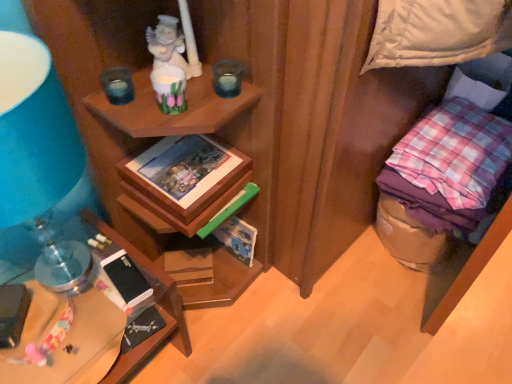
Locate an element on the screen. transparent glass candle at upper center, the first candle holder in the right-to-left sequence is located at coordinates (227, 78).

This screenshot has width=512, height=384. Identify the location of wooden picture frame at center. (185, 173).

Find the location of `wooden desk at lower left`. wooden desk at lower left is located at coordinates (96, 325).

What do you see at coordinates (169, 89) in the screenshot? The image size is (512, 384). I see `white glossy cup at upper center, the 2th candle holder in the right-to-left sequence` at bounding box center [169, 89].

Measure the distance between black matte mobile phone at lower left, the 2th mobile phone viewed from the left, and camera.

black matte mobile phone at lower left, the 2th mobile phone viewed from the left, is 1.00 meters from camera.

In order to face brown cardboard magazine at lower center, should I rotate leftwards or rightwards?

To align with it, rotate left about 8.852°.

This screenshot has width=512, height=384. What are the coordinates of `brown cardboard magazine at lower center` in the screenshot? It's located at (189, 266).

Measure the distance between point (460,108) and camera.

1.28 meters.

Where is `transparent glass candle at upper center, the first candle holder in the right-to-left sequence`? Image resolution: width=512 pixels, height=384 pixels. transparent glass candle at upper center, the first candle holder in the right-to-left sequence is located at coordinates (227, 78).

Is wooden desk at lower left looking in the opposite direction of wooden picture frame at center?

No, wooden desk at lower left's orientation is not away from wooden picture frame at center.

Is wooden desk at lower left wider than wooden picture frame at center?

Yes.

Which object is positioned more to the left, wooden desk at lower left or wooden picture frame at center?

wooden desk at lower left.

At what (x,y) coordinates should I click in order to perform the action: click on desk in front of the wooden picture frame at center. Please return your answer as a coordinate pair (x, y). The height and width of the screenshot is (384, 512). Looking at the image, I should click on (96, 325).

From a real-world perspective, is brown cardboard magazine at lower center physically above white glossy cup at upper center, the 2th candle holder positioned from the left?

No, from a real-world perspective, brown cardboard magazine at lower center is not on top of white glossy cup at upper center, the 2th candle holder positioned from the left.

Which is closer to the camera, [170,258] or [178,68]?

Point [170,258].

How different are the orientations of brown cardboard magazine at lower center and white glossy cup at upper center, the 2th candle holder in the right-to-left sequence, in degrees?

brown cardboard magazine at lower center and white glossy cup at upper center, the 2th candle holder in the right-to-left sequence, are facing 8.82 degrees away from each other.

Is brown cardboard magazine at lower center turned away from white glossy cup at upper center, the 2th candle holder in the right-to-left sequence?

No, brown cardboard magazine at lower center is not facing away from white glossy cup at upper center, the 2th candle holder in the right-to-left sequence.

How many degrees apart are the facing directions of wooden picture frame at center and wooden desk at lower left?

0.0576 degrees separate the facing orientations of wooden picture frame at center and wooden desk at lower left.

Is wooden picture frame at center looking in the opposite direction of wooden desk at lower left?

No, wooden picture frame at center's orientation is not away from wooden desk at lower left.

Considering the relative positions of wooden picture frame at center and wooden desk at lower left in the image provided, is wooden picture frame at center to the right of wooden desk at lower left from the viewer's perspective?

Yes.

Is wooden picture frame at center next to wooden desk at lower left and touching it?

No, wooden picture frame at center is not in contact with wooden desk at lower left.

Considering the relative sizes of brown cardboard magazine at lower center and translucent glass candle at upper center, marked as the 3th candle holder in a right-to-left arrangement, in the image provided, is brown cardboard magazine at lower center wider than translucent glass candle at upper center, marked as the 3th candle holder in a right-to-left arrangement,?

Yes, brown cardboard magazine at lower center is wider than translucent glass candle at upper center, marked as the 3th candle holder in a right-to-left arrangement.

Does brown cardboard magazine at lower center appear on the right side of translucent glass candle at upper center, marked as the 3th candle holder in a right-to-left arrangement?

Yes, brown cardboard magazine at lower center is to the right of translucent glass candle at upper center, marked as the 3th candle holder in a right-to-left arrangement.

Would you say translucent glass candle at upper center, marked as the 3th candle holder in a right-to-left arrangement, is part of brown cardboard magazine at lower center's contents?

No.

Which object is wider, wooden picture frame at center or translucent glass candle at upper center, the first candle holder in the left-to-right sequence?

wooden picture frame at center is wider.

From a real-world perspective, which object stands above the other?

translucent glass candle at upper center, the first candle holder in the left-to-right sequence.

Is wooden picture frame at center facing towards translucent glass candle at upper center, the first candle holder in the left-to-right sequence?

No, wooden picture frame at center does not turn towards translucent glass candle at upper center, the first candle holder in the left-to-right sequence.

Do you think wooden picture frame at center is within translucent glass candle at upper center, the first candle holder in the left-to-right sequence, or outside of it?

The correct answer is: outside.

How many degrees apart are the facing directions of white glossy cup at upper center, the 2th candle holder positioned from the left, and translucent glass candle at upper center, the first candle holder in the left-to-right sequence?

2.35 degrees.

Considering the positions of objects white glossy cup at upper center, the 2th candle holder positioned from the left, and translucent glass candle at upper center, the first candle holder in the left-to-right sequence, in the image provided, who is more to the left, white glossy cup at upper center, the 2th candle holder positioned from the left, or translucent glass candle at upper center, the first candle holder in the left-to-right sequence,?

translucent glass candle at upper center, the first candle holder in the left-to-right sequence, is more to the left.

From a real-world perspective, does white glossy cup at upper center, the 2th candle holder positioned from the left, sit lower than translucent glass candle at upper center, the first candle holder in the left-to-right sequence?

Actually, white glossy cup at upper center, the 2th candle holder positioned from the left, is physically above translucent glass candle at upper center, the first candle holder in the left-to-right sequence, in the real world.

Is white glossy cup at upper center, the 2th candle holder positioned from the left, shorter than translucent glass candle at upper center, marked as the 3th candle holder in a right-to-left arrangement?

In fact, white glossy cup at upper center, the 2th candle holder positioned from the left, may be taller than translucent glass candle at upper center, marked as the 3th candle holder in a right-to-left arrangement.

Considering the sizes of objects black matte mobile phone at lower left, the 1th mobile phone viewed from the right, and translucent glass candle at upper center, marked as the 3th candle holder in a right-to-left arrangement, in the image provided, who is shorter, black matte mobile phone at lower left, the 1th mobile phone viewed from the right, or translucent glass candle at upper center, marked as the 3th candle holder in a right-to-left arrangement,?

black matte mobile phone at lower left, the 1th mobile phone viewed from the right.

Are black matte mobile phone at lower left, the 2th mobile phone viewed from the left, and translucent glass candle at upper center, marked as the 3th candle holder in a right-to-left arrangement, beside each other?

No, black matte mobile phone at lower left, the 2th mobile phone viewed from the left, is not in contact with translucent glass candle at upper center, marked as the 3th candle holder in a right-to-left arrangement.

From a real-world perspective, which is physically above, black matte mobile phone at lower left, the 1th mobile phone viewed from the right, or translucent glass candle at upper center, the first candle holder in the left-to-right sequence?

In real-world perspective, translucent glass candle at upper center, the first candle holder in the left-to-right sequence, is above.

How many degrees apart are the facing directions of black matte mobile phone at lower left, the 2th mobile phone viewed from the left, and translucent glass candle at upper center, marked as the 3th candle holder in a right-to-left arrangement?

They differ by 25.2 degrees in their facing directions.

Where is `desk located underneath the wooden picture frame at center (from a real-world perspective)`? desk located underneath the wooden picture frame at center (from a real-world perspective) is located at coordinates (96, 325).

Image resolution: width=512 pixels, height=384 pixels. In order to click on the 3rd candle holder above the brown cardboard magazine at lower center (from a real-world perspective) in this screenshot , I will do click(x=169, y=89).

Which object lies nearer to the anchor point white glossy cup at upper center, the 2th candle holder positioned from the left, brown cardboard magazine at lower center or translucent glass candle at upper center, marked as the 3th candle holder in a right-to-left arrangement?

The object closer to white glossy cup at upper center, the 2th candle holder positioned from the left, is translucent glass candle at upper center, marked as the 3th candle holder in a right-to-left arrangement.

Which object lies nearer to the anchor point pink checkered fabric at right, black matte mobile phone at lower left, the 2th mobile phone viewed from the left, or black matte mobile phone at lower left, which is counted as the second mobile phone, starting from the right?

Among the two, black matte mobile phone at lower left, the 2th mobile phone viewed from the left, is located nearer to pink checkered fabric at right.

Which object lies nearer to the anchor point black matte mobile phone at lower left, which is counted as the second mobile phone, starting from the right, translucent glass candle at upper center, marked as the 3th candle holder in a right-to-left arrangement, or wooden desk at lower left?

wooden desk at lower left is closer to black matte mobile phone at lower left, which is counted as the second mobile phone, starting from the right.

When comparing their distances from wooden desk at lower left, does black matte mobile phone at lower left, the first mobile phone viewed from the left, or porcelain statue at upper center seem closer?

The object closer to wooden desk at lower left is black matte mobile phone at lower left, the first mobile phone viewed from the left.

Based on their spatial positions, is pink checkered fabric at right or black matte mobile phone at lower left, which is counted as the second mobile phone, starting from the right, closer to transparent glass candle at upper center, the third candle holder in the left-to-right sequence?

Among the two, black matte mobile phone at lower left, which is counted as the second mobile phone, starting from the right, is located nearer to transparent glass candle at upper center, the third candle holder in the left-to-right sequence.

Estimate the real-world distances between objects in this image. Which object is closer to black matte mobile phone at lower left, which is counted as the second mobile phone, starting from the right, translucent glass candle at upper center, marked as the 3th candle holder in a right-to-left arrangement, or black matte mobile phone at lower left, the 2th mobile phone viewed from the left?

Among the two, black matte mobile phone at lower left, the 2th mobile phone viewed from the left, is located nearer to black matte mobile phone at lower left, which is counted as the second mobile phone, starting from the right.

Considering their positions, is wooden desk at lower left positioned closer to black matte mobile phone at lower left, the 1th mobile phone viewed from the right, than translucent glass candle at upper center, marked as the 3th candle holder in a right-to-left arrangement?

Among the two, wooden desk at lower left is located nearer to black matte mobile phone at lower left, the 1th mobile phone viewed from the right.

Based on their spatial positions, is black matte mobile phone at lower left, the 1th mobile phone viewed from the right, or porcelain statue at upper center closer to black matte mobile phone at lower left, the first mobile phone viewed from the left?

Among the two, black matte mobile phone at lower left, the 1th mobile phone viewed from the right, is located nearer to black matte mobile phone at lower left, the first mobile phone viewed from the left.

Image resolution: width=512 pixels, height=384 pixels. Find the location of `mobile phone between translucent glass candle at upper center, the first candle holder in the left-to-right sequence, and pink checkered fabric at right`. mobile phone between translucent glass candle at upper center, the first candle holder in the left-to-right sequence, and pink checkered fabric at right is located at coordinates (126, 278).

Locate an element on the screen. Image resolution: width=512 pixels, height=384 pixels. candle holder between translucent glass candle at upper center, marked as the 3th candle holder in a right-to-left arrangement, and transparent glass candle at upper center, the third candle holder in the left-to-right sequence, from left to right is located at coordinates (169, 89).

You are a GUI agent. You are given a task and a screenshot of the screen. Output one action in this format:
    pyautogui.click(x=<x>, y=<y>)
    Task: Click on the magazine between translucent glass candle at upper center, the first candle holder in the left-to-right sequence, and wooden desk at lower left vertically
    
    Given the screenshot: What is the action you would take?
    pyautogui.click(x=189, y=266)

Locate an element on the screen. person between black matte mobile phone at lower left, which is counted as the second mobile phone, starting from the right, and pink checkered fabric at right is located at coordinates (173, 45).